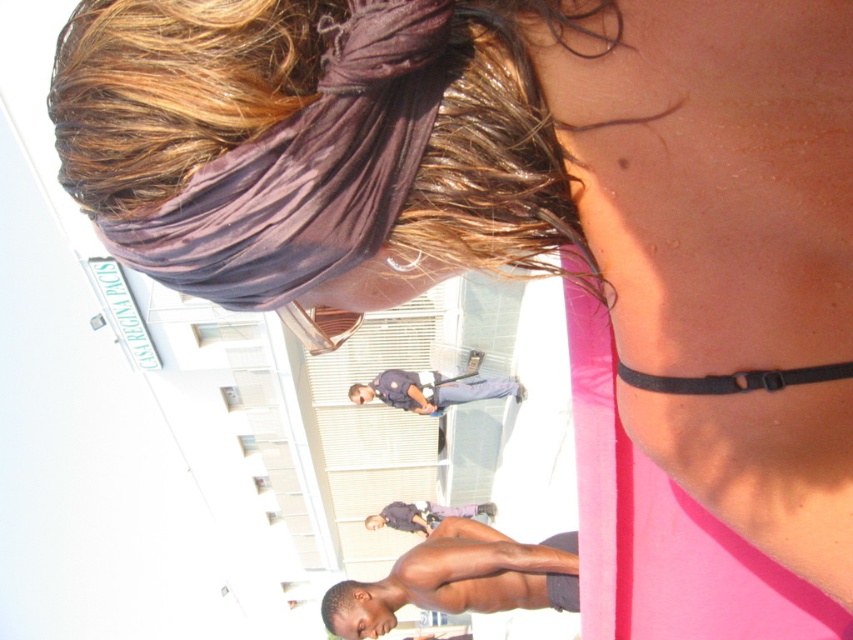
Question: Which of the following is the farthest from the observer?

Choices:
 (A) (468, 572)
 (B) (305, 230)
 (C) (349, 582)

Answer: (C)

Question: Which of these objects is positioned farthest from the purple satin headband at upper center?

Choices:
 (A) brown skin man at lower center
 (B) smooth skin head at lower center
 (C) dark blue uniform at center
 (D) dark purple shirt at center

Answer: (D)

Question: Does purple satin headband at upper center appear over smooth skin head at lower center?

Choices:
 (A) yes
 (B) no

Answer: (A)

Question: Can you confirm if dark blue uniform at center is positioned to the left of dark purple shirt at center?

Choices:
 (A) yes
 (B) no

Answer: (B)

Question: Does dark blue uniform at center appear under dark purple shirt at center?

Choices:
 (A) no
 (B) yes

Answer: (A)

Question: Which of the following is the farthest from the observer?

Choices:
 (A) smooth skin head at lower center
 (B) purple satin headband at upper center
 (C) dark purple shirt at center

Answer: (C)